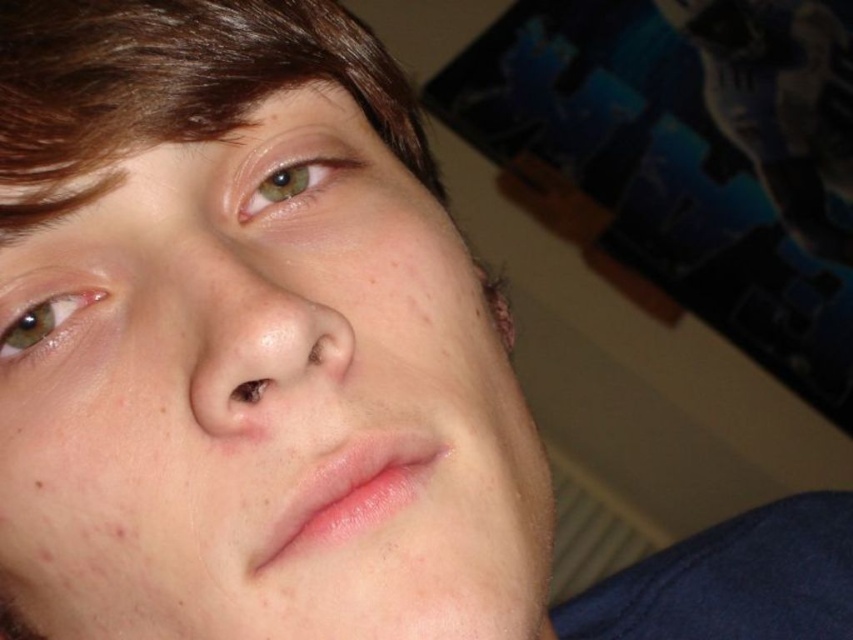
Question: Does smooth skin face at center have a smaller size compared to brown matte eye at lower left?

Choices:
 (A) no
 (B) yes

Answer: (A)

Question: Which of the following is the farthest from the observer?

Choices:
 (A) smooth skin face at center
 (B) brown matte eye at lower left
 (C) green matte eye at upper left

Answer: (C)

Question: Is smooth skin face at center closer to the viewer compared to brown matte eye at lower left?

Choices:
 (A) yes
 (B) no

Answer: (A)

Question: Does smooth skin face at center appear under brown matte eye at lower left?

Choices:
 (A) yes
 (B) no

Answer: (A)

Question: Which point appears closest to the camera in this image?

Choices:
 (A) (279, 198)
 (B) (48, 317)
 (C) (368, 301)

Answer: (B)

Question: Which object is positioned closest to the brown matte eye at lower left?

Choices:
 (A) green matte eye at upper left
 (B) smooth skin face at center

Answer: (A)